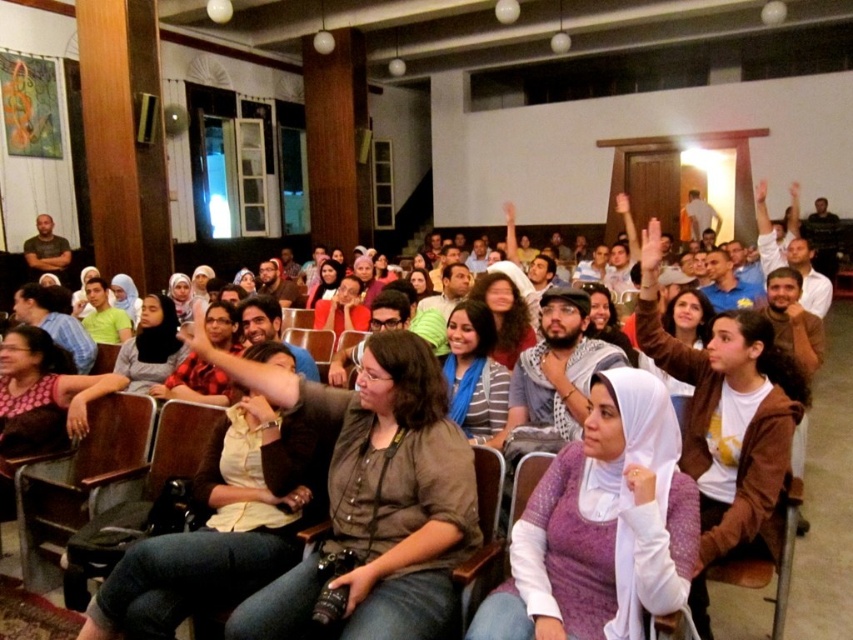
You are a GUI agent. You are given a task and a screenshot of the screen. Output one action in this format:
    pyautogui.click(x=<x>, y=<y>)
    Task: Click on the striped shirt at center
    
    Given the screenshot: What is the action you would take?
    pyautogui.click(x=474, y=372)

Can you confirm if brown fabric shirt at center is positioned above matte black shirt at left?

Actually, brown fabric shirt at center is below matte black shirt at left.

Measure the distance from brown fabric shirt at center to matte black shirt at left.

brown fabric shirt at center is 7.02 meters away from matte black shirt at left.

Who is more distant from viewer, (271, 388) or (62, 246)?

The point (62, 246) is behind.

Where is `brown fabric shirt at center`? brown fabric shirt at center is located at coordinates (376, 499).

Is light brown leather jacket at center thinner than matte black shirt at center?

Indeed, light brown leather jacket at center has a lesser width compared to matte black shirt at center.

Is point (97, 602) farther from camera compared to point (65, 324)?

No, it is not.

Who is more forward, (236, 408) or (33, 305)?

Point (236, 408) is in front.

The height and width of the screenshot is (640, 853). Identify the location of light brown leather jacket at center. (221, 525).